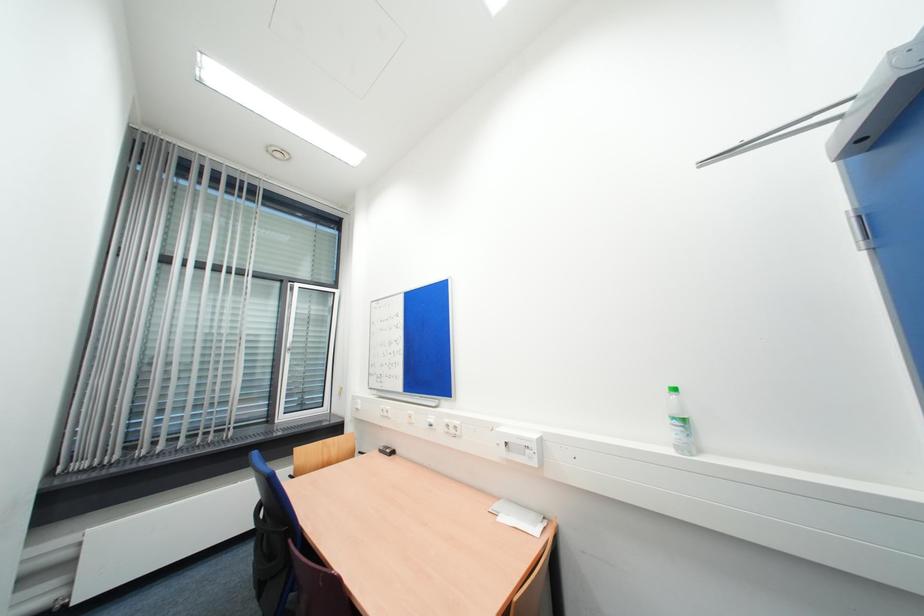
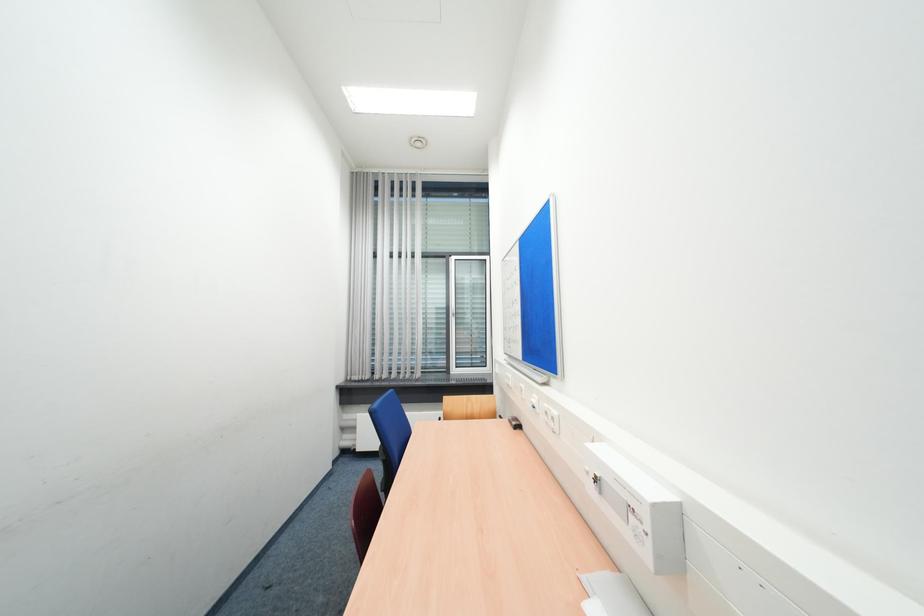
Question: Based on the continuous images, in which direction is the camera rotating? Reply with the corresponding letter.

Choices:
 (A) Left
 (B) Right
 (C) Up
 (D) Down

Answer: (A)